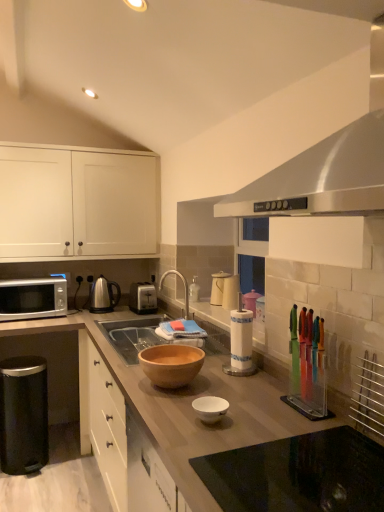
Question: Is matte white kettle at center, the third appliance positioned from the left, thinner than silver metallic microwave at left?

Choices:
 (A) no
 (B) yes

Answer: (B)

Question: Considering the relative sizes of matte white kettle at center, the fourth appliance in the front-to-back sequence, and silver metallic microwave at left in the image provided, is matte white kettle at center, the fourth appliance in the front-to-back sequence, shorter than silver metallic microwave at left?

Choices:
 (A) yes
 (B) no

Answer: (A)

Question: From a real-world perspective, is matte white kettle at center, the third appliance positioned from the left, located higher than silver metallic microwave at left?

Choices:
 (A) no
 (B) yes

Answer: (B)

Question: Does matte white kettle at center, which is the third appliance in right-to-left order, have a larger size compared to silver metallic microwave at left?

Choices:
 (A) no
 (B) yes

Answer: (A)

Question: From the image's perspective, is matte white kettle at center, which is the third appliance in right-to-left order, above silver metallic microwave at left?

Choices:
 (A) no
 (B) yes

Answer: (B)

Question: Considering the relative positions of matte white kettle at center, which is the third appliance in right-to-left order, and silver metallic microwave at left in the image provided, is matte white kettle at center, which is the third appliance in right-to-left order, behind silver metallic microwave at left?

Choices:
 (A) yes
 (B) no

Answer: (B)

Question: Is wooden bowl at center further to the viewer compared to wooden bowl at center, the 2th bowl when ordered from front to back?

Choices:
 (A) no
 (B) yes

Answer: (B)

Question: From a real-world perspective, is wooden bowl at center under wooden bowl at center, the 2th bowl when ordered from front to back?

Choices:
 (A) no
 (B) yes

Answer: (B)

Question: Can you confirm if wooden bowl at center is shorter than wooden bowl at center, the 2th bowl when ordered from front to back?

Choices:
 (A) no
 (B) yes

Answer: (B)

Question: Is wooden bowl at center at the left side of wooden bowl at center, the first bowl viewed from the back?

Choices:
 (A) yes
 (B) no

Answer: (A)

Question: Is wooden bowl at center in front of wooden bowl at center, the first bowl viewed from the back?

Choices:
 (A) no
 (B) yes

Answer: (A)

Question: Is wooden bowl at center taller than wooden bowl at center, the first bowl viewed from the back?

Choices:
 (A) yes
 (B) no

Answer: (B)

Question: Is white matte cabinet at upper left not inside satin silver toaster at center, acting as the 5th appliance starting from the front?

Choices:
 (A) no
 (B) yes

Answer: (B)